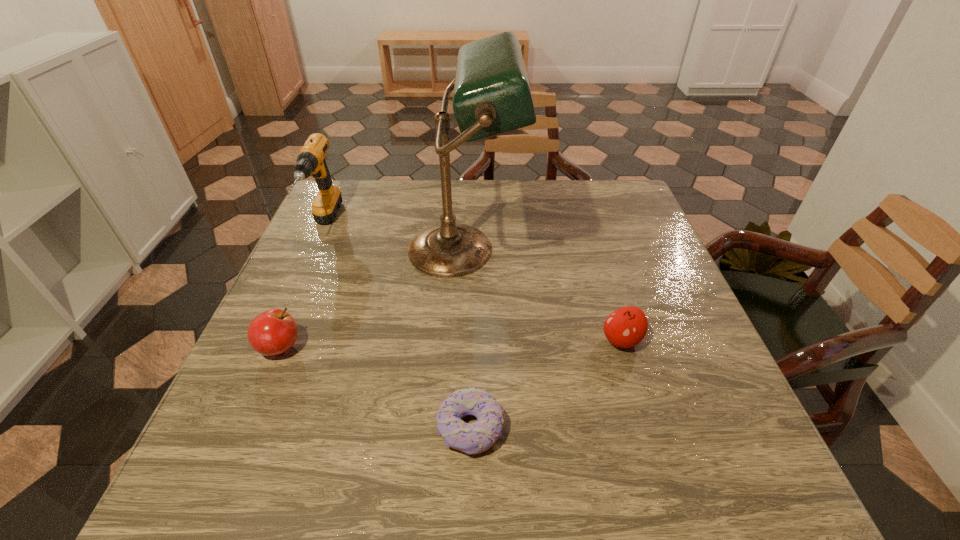
Where is `free spot that satisfies the following two spatial constraints: 1. at the tip of the drill; 2. on the left side of the left apple`? The width and height of the screenshot is (960, 540). free spot that satisfies the following two spatial constraints: 1. at the tip of the drill; 2. on the left side of the left apple is located at coordinates (269, 347).

In order to click on vacant space that satisfies the following two spatial constraints: 1. on the front side of the doughnut; 2. on the right side of the left apple in this screenshot , I will do `click(246, 428)`.